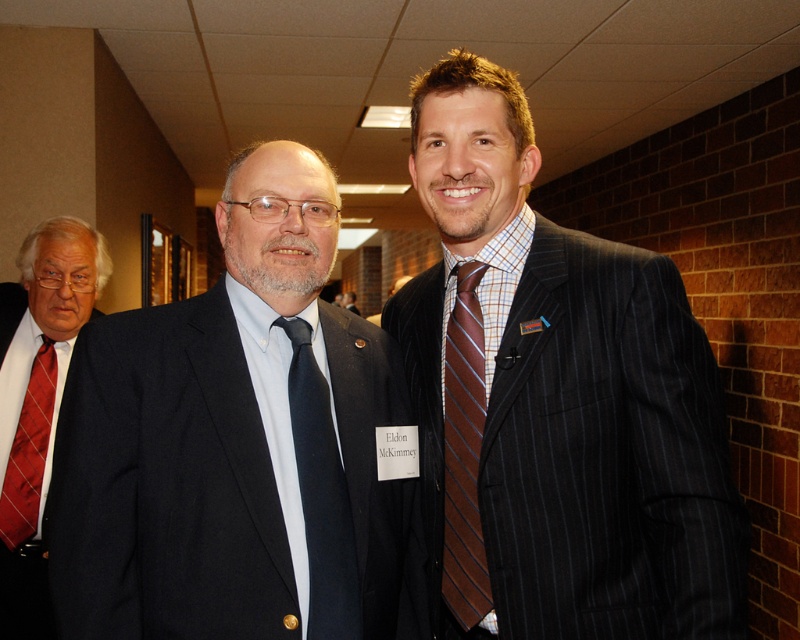
You are a photographer at a formal event and need to adjust the lighting to ensure both the matte black tie at center and the brown striped tie at center are well lit. Considering their positions, which tie might require more light adjustment to avoid appearing too dark?

The matte black tie at center is shorter than the brown striped tie at center. Since black absorbs more light, the matte black tie at center may require more light adjustment to ensure it doesn not appear too dark compared to the brown striped tie at center.

Looking at this image, you are a photographer setting up for a group photo. You need to position two men so their ties are closer to each other for the shot. The men are currently standing with their brown striped tie at center and red satin tie at left. Given the current distance between their ties is 5.30 feet, is this distance acceptable for a group photo where ties should be within 3 feet of each other?

The distance between the brown striped tie at center and the red satin tie at left is 5.30 feet, which exceeds the required 3 feet. Therefore, the men need to move closer to ensure their ties are within the 3 feet requirement for the group photo.